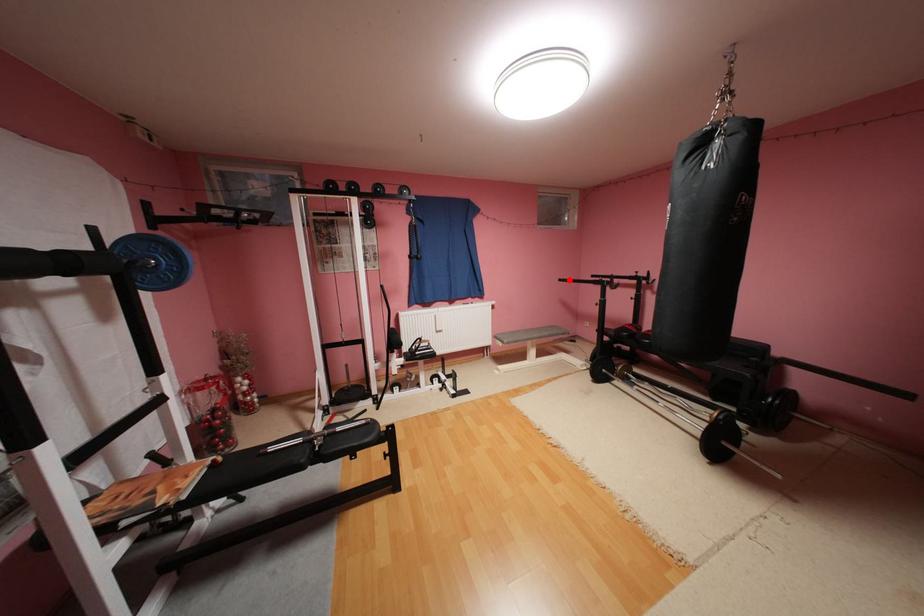
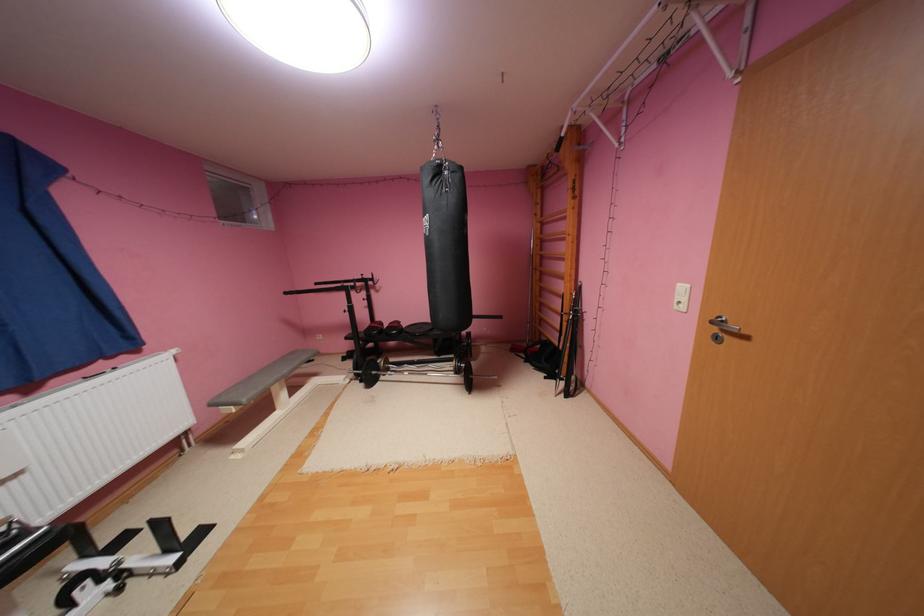
Find the pixel in the second image that matches the highlighted location in the first image.

(295, 293)